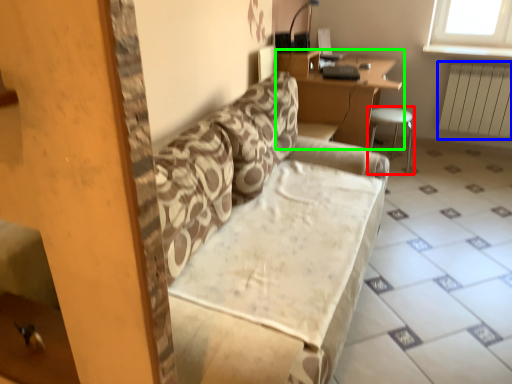
Question: Which is farther away from furniture (highlighted by a red box)? radiator (highlighted by a blue box) or table (highlighted by a green box)?

Choices:
 (A) radiator
 (B) table

Answer: (A)